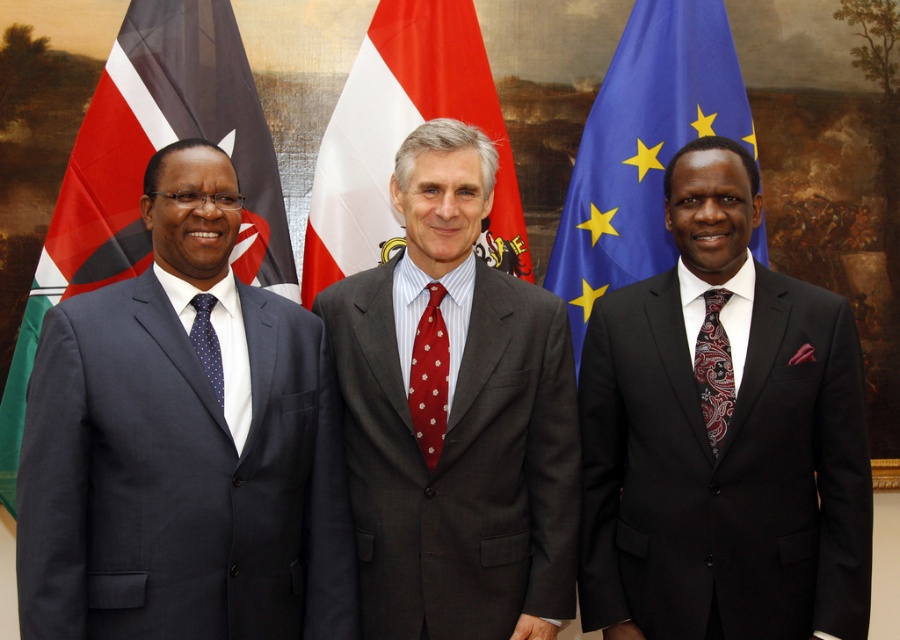
Can you confirm if matte gray suit at center is wider than red dotted fabric tie at center?

Yes.

Looking at this image, is the position of matte gray suit at center less distant than that of red dotted fabric tie at center?

Yes, matte gray suit at center is in front of red dotted fabric tie at center.

Is point (474, 442) positioned behind point (443, 372)?

No, (474, 442) is in front of (443, 372).

I want to click on matte gray suit at center, so click(x=455, y=417).

Can you confirm if black satin suit at right is shorter than paisley silk tie at right?

No.

Does black satin suit at right have a greater width compared to paisley silk tie at right?

Indeed, black satin suit at right has a greater width compared to paisley silk tie at right.

Find the location of `black satin suit at right`. black satin suit at right is located at coordinates click(x=722, y=436).

Does navy wool suit at left have a greater height compared to red flag at left?

In fact, navy wool suit at left may be shorter than red flag at left.

Which is behind, point (128, 456) or point (140, 54)?

Point (140, 54)

Does point (112, 554) come farther from viewer compared to point (187, 4)?

No.

The image size is (900, 640). In order to click on navy wool suit at left in this screenshot , I will do `click(180, 477)`.